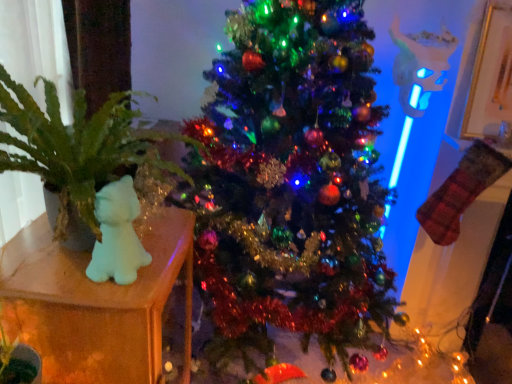
Describe the element at coordinates (291, 183) in the screenshot. Image resolution: width=512 pixels, height=384 pixels. I see `shiny green christmas tree at center` at that location.

What is the approximate width of green leafy plant at left?

green leafy plant at left is 61.31 centimeters wide.

What do you see at coordinates (94, 304) in the screenshot? I see `translucent plastic bear at left` at bounding box center [94, 304].

The width and height of the screenshot is (512, 384). Find the location of `shiny green christmas tree at center`. shiny green christmas tree at center is located at coordinates (291, 183).

Based on the photo, from the image's perspective, is translucent plastic bear at left under green leafy plant at left?

Yes, from the image's perspective, translucent plastic bear at left is beneath green leafy plant at left.

From a real-world perspective, is translucent plastic bear at left positioned above or below green leafy plant at left?

translucent plastic bear at left is situated lower than green leafy plant at left in the real world.

Which object is thinner, translucent plastic bear at left or green leafy plant at left?

translucent plastic bear at left.

Looking at this image, considering the sizes of objects translucent plastic bear at left and green leafy plant at left in the image provided, who is taller, translucent plastic bear at left or green leafy plant at left?

translucent plastic bear at left is taller.

From a real-world perspective, is shiny green christmas tree at center above or below green leafy plant at left?

Clearly, from a real-world perspective, shiny green christmas tree at center is below green leafy plant at left.

From the image's perspective, is shiny green christmas tree at center over green leafy plant at left?

No.

Which of these two, green leafy plant at left or shiny green christmas tree at center, stands shorter?

green leafy plant at left.

Considering the sizes of green leafy plant at left and shiny green christmas tree at center in the image, is green leafy plant at left wider or thinner than shiny green christmas tree at center?

green leafy plant at left is thinner than shiny green christmas tree at center.

From the picture: Would you say green leafy plant at left is inside or outside shiny green christmas tree at center?

green leafy plant at left is spatially situated outside shiny green christmas tree at center.

The width and height of the screenshot is (512, 384). What are the coordinates of `christmas tree behind the green leafy plant at left` in the screenshot? It's located at (291, 183).

This screenshot has width=512, height=384. What are the coordinates of `christmas tree in front of the translucent plastic bear at left` in the screenshot? It's located at (291, 183).

Which of these two, shiny green christmas tree at center or translucent plastic bear at left, is thinner?

Thinner between the two is translucent plastic bear at left.

Consider the image. From a real-world perspective, between shiny green christmas tree at center and translucent plastic bear at left, who is vertically lower?

translucent plastic bear at left, from a real-world perspective.

From a real-world perspective, does translucent plastic bear at left stand above shiny green christmas tree at center?

No, from a real-world perspective, translucent plastic bear at left is not on top of shiny green christmas tree at center.

Does translucent plastic bear at left have a greater width compared to shiny green christmas tree at center?

No.

Is translucent plastic bear at left oriented away from shiny green christmas tree at center?

No.

Which object is closer to the camera taking this photo, translucent plastic bear at left or shiny green christmas tree at center?

shiny green christmas tree at center is in front.

From a real-world perspective, which is physically above, green leafy plant at left or translucent plastic bear at left?

From a 3D spatial view, green leafy plant at left is above.

Which is in front, green leafy plant at left or translucent plastic bear at left?

green leafy plant at left is closer to the camera.

Would you consider green leafy plant at left to be distant from translucent plastic bear at left?

No, green leafy plant at left is not far away from translucent plastic bear at left.

Is green leafy plant at left outside of translucent plastic bear at left?

Yes.

What are the coordinates of `houseplant in front of the translucent plastic bear at left` in the screenshot? It's located at (75, 146).

Where is `houseplant that is above the shiny green christmas tree at center (from a real-world perspective)`? This screenshot has width=512, height=384. houseplant that is above the shiny green christmas tree at center (from a real-world perspective) is located at coordinates (75, 146).

Which object lies further to the anchor point translucent plastic bear at left, shiny green christmas tree at center or green leafy plant at left?

shiny green christmas tree at center.

From the image, which object appears to be farther from green leafy plant at left, translucent plastic bear at left or shiny green christmas tree at center?

The object further to green leafy plant at left is shiny green christmas tree at center.

Which object lies nearer to the anchor point green leafy plant at left, shiny green christmas tree at center or translucent plastic bear at left?

translucent plastic bear at left is closer to green leafy plant at left.

Which object lies further to the anchor point shiny green christmas tree at center, translucent plastic bear at left or green leafy plant at left?

translucent plastic bear at left is further to shiny green christmas tree at center.

From the picture: Based on their spatial positions, is green leafy plant at left or shiny green christmas tree at center further from translucent plastic bear at left?

shiny green christmas tree at center lies further to translucent plastic bear at left than the other object.

Which object lies nearer to the anchor point shiny green christmas tree at center, green leafy plant at left or translucent plastic bear at left?

Based on the image, green leafy plant at left appears to be nearer to shiny green christmas tree at center.

At what (x,y) coordinates should I click in order to perform the action: click on houseplant between translucent plastic bear at left and shiny green christmas tree at center. Please return your answer as a coordinate pair (x, y). The height and width of the screenshot is (384, 512). Looking at the image, I should click on (75, 146).